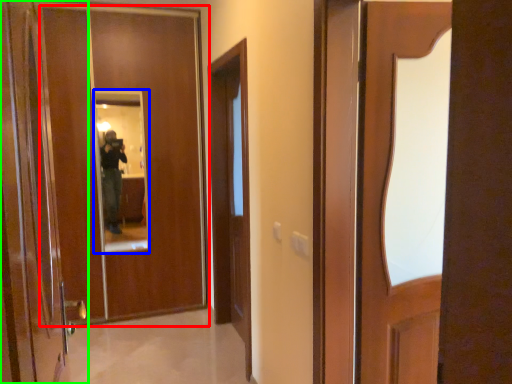
Question: Based on their relative distances, which object is nearer to door (highlighted by a red box)? Choose from mirror (highlighted by a blue box) and door (highlighted by a green box).

Choices:
 (A) mirror
 (B) door

Answer: (A)